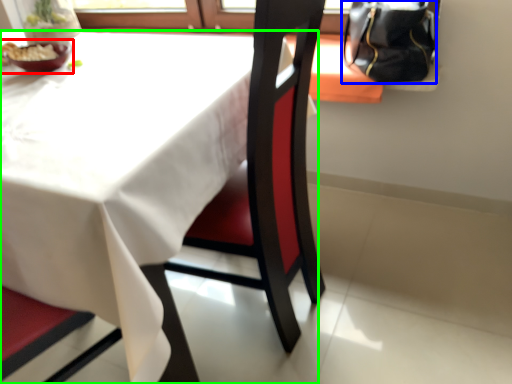
Question: Based on their relative distances, which object is farther from tableware (highlighted by a red box)? Choose from handbag (highlighted by a blue box) and table (highlighted by a green box).

Choices:
 (A) handbag
 (B) table

Answer: (A)